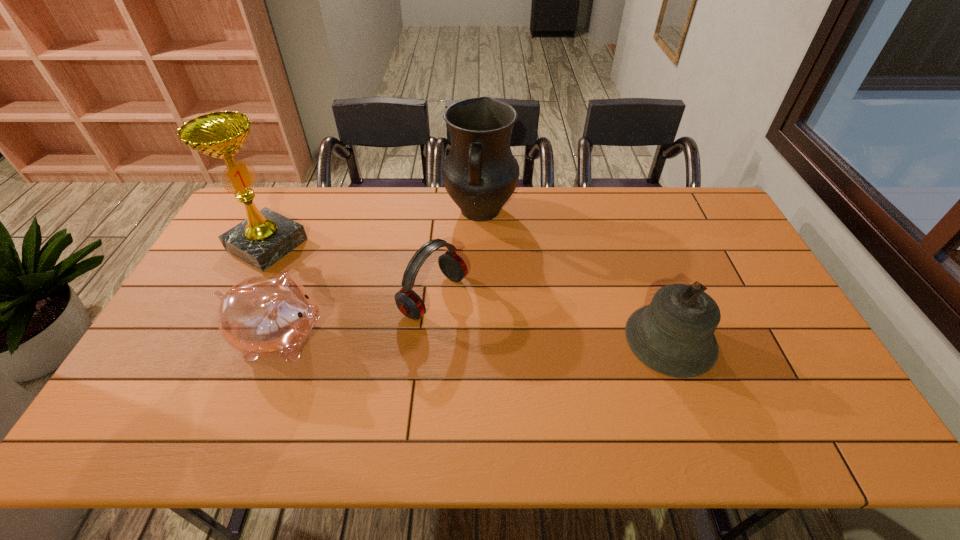
I want to click on piggy bank, so click(272, 315).

The width and height of the screenshot is (960, 540). In order to click on bell in this screenshot , I will do `click(674, 335)`.

At what (x,y) coordinates should I click in order to perform the action: click on earphone. Please return your answer as a coordinate pair (x, y). The image size is (960, 540). Looking at the image, I should click on (409, 303).

You are a GUI agent. You are given a task and a screenshot of the screen. Output one action in this format:
    pyautogui.click(x=<x>, y=<y>)
    Task: Click on the award
    
    Given the screenshot: What is the action you would take?
    pyautogui.click(x=266, y=236)

The width and height of the screenshot is (960, 540). Find the location of `pitcher`. pitcher is located at coordinates (480, 173).

Locate an element on the screen. The width and height of the screenshot is (960, 540). free space located 0.320m on the front facing side of the piggy bank is located at coordinates pyautogui.click(x=446, y=340).

This screenshot has height=540, width=960. In order to click on free region located 0.070m on the left of the rightmost object in this screenshot , I will do `click(600, 340)`.

The image size is (960, 540). In order to click on free location located 0.120m on the ear cups of the earphone in this screenshot , I will do `click(494, 335)`.

I want to click on vacant space located 0.320m on the ear cups of the earphone, so click(558, 373).

Where is `vacant space situated 0.190m on the ear cups of the earphone`? Image resolution: width=960 pixels, height=540 pixels. vacant space situated 0.190m on the ear cups of the earphone is located at coordinates (516, 347).